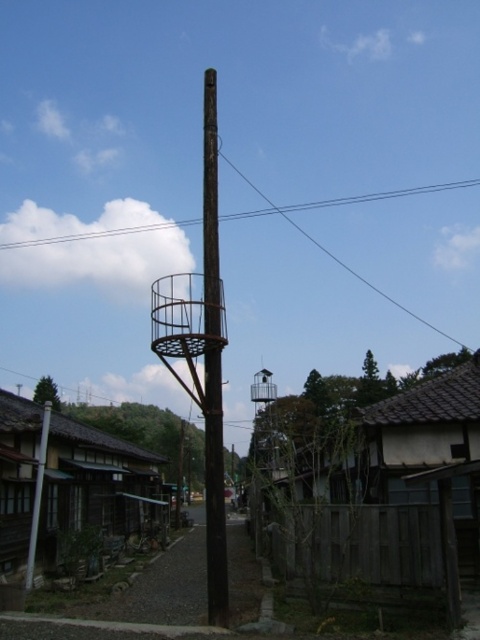
You are a photographer standing at the camera position. You want to take a photo of the rustic wood tower at center. Can you fit the entire tower into your camera frame without moving? The camera has a maximum horizontal field of view of 60 degrees and the tower is 20 feet wide.

The rustic wood tower at center is 20 feet wide and located 37.63 feet away from the camera. Using trigonometry, the angle required to capture the tower would be 2 times the arctangent of half the width divided by distance. Calculating this gives 26.56 degrees, which is within the camera maximum 60 degrees field of view. Therefore, the entire tower can be captured without moving.

You are a photographer planning to capture the entire scene in one shot. Given that the wooden shingles hut at lower left and the black wire at upper center are both in your frame, which object would require you to adjust your camera angle more to ensure both are fully visible?

The wooden shingles hut at lower left has a smaller size compared to black wire at upper center, so you would need to adjust your camera angle more to ensure the smaller wooden shingles hut at lower left is fully visible while keeping the larger black wire at upper center in frame.